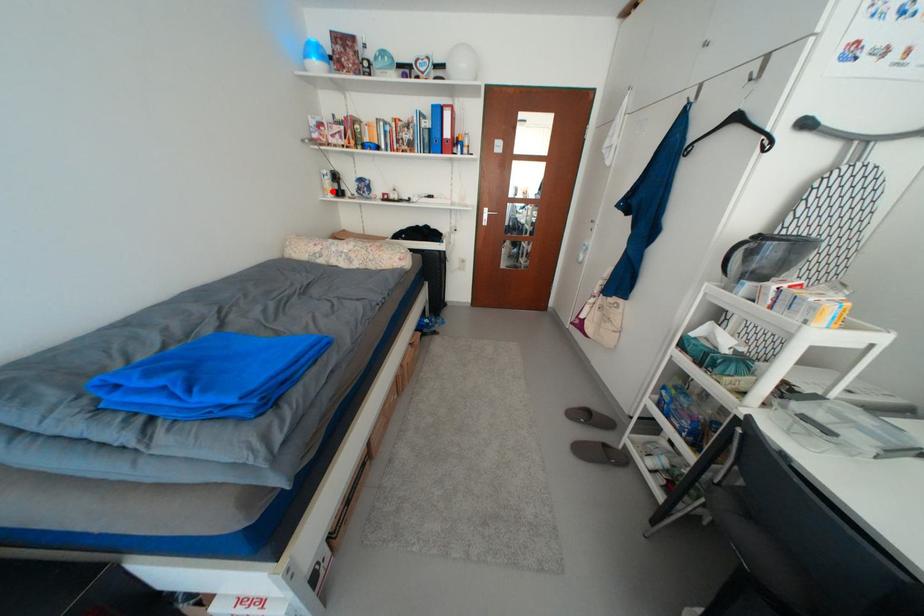
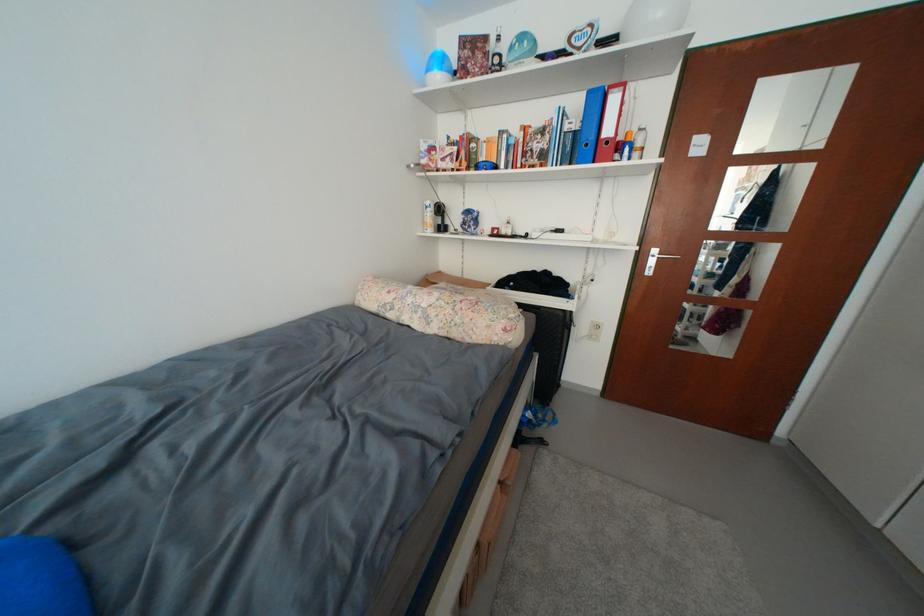
The point at the highlighted location is marked in the first image. Where is the corresponding point in the second image?

(432, 225)